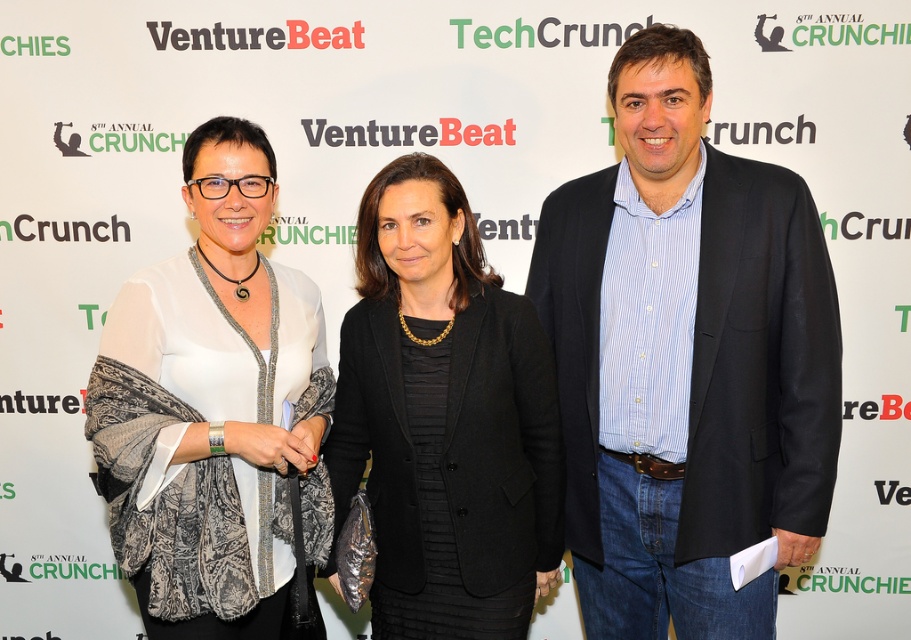
Based on the scene description, can you determine which clothing item is visible on top between the white sheer blouse at center and the black textured blazer at center?

The white sheer blouse at center is positioned over the black textured blazer at center, making it visible on top.

You are a photographer setting up for an event photo. You notice the blue striped shirt at center and the black textured blazer at center in your frame. Which object should you focus on if you want to capture the taller one?

The blue striped shirt at center is taller than the black textured blazer at center, so you should focus on the blue striped shirt at center.